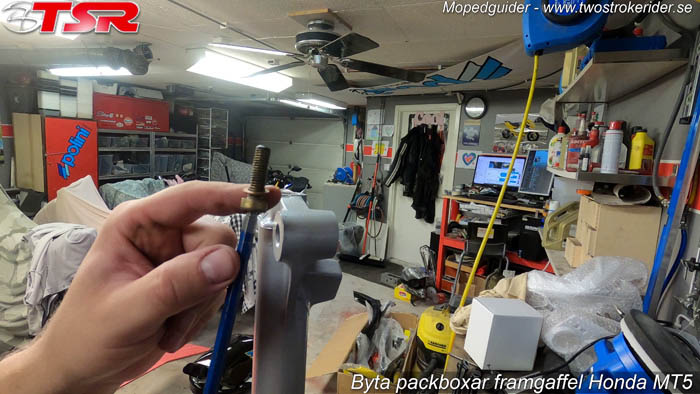
The image size is (700, 394). Find the location of `ceiling fan`. ceiling fan is located at coordinates (313, 56).